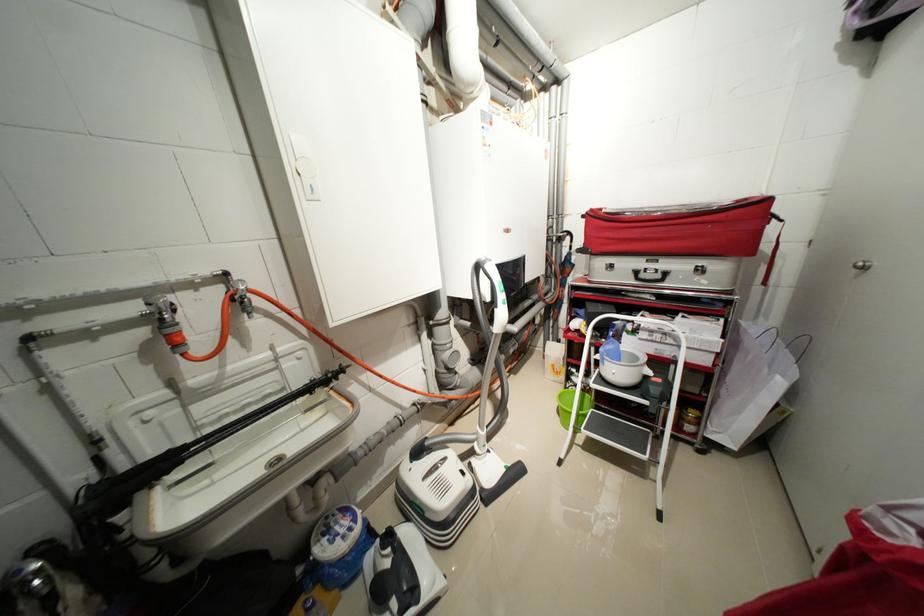
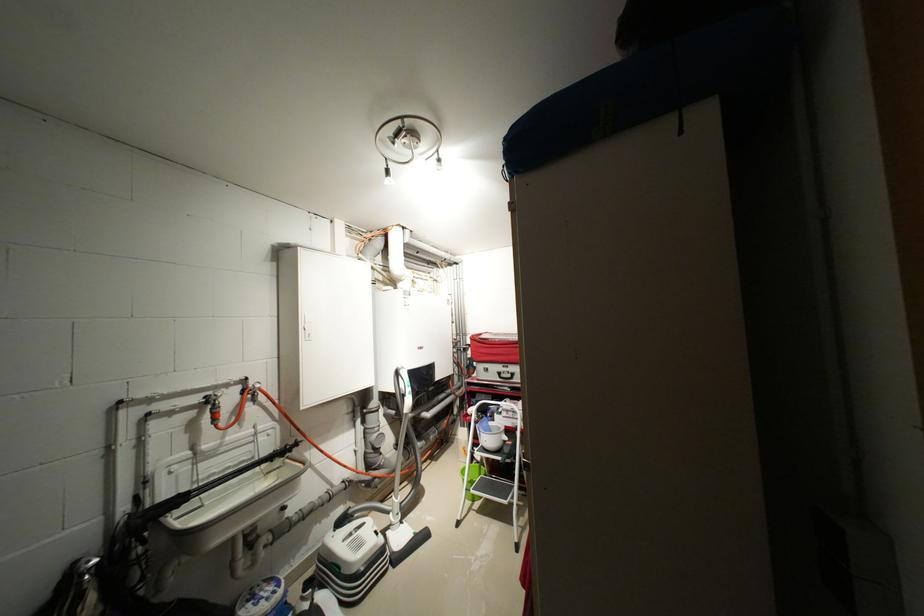
Question: I am providing you with two images of the same scene from different viewpoints. Please identify which objects are invisible in image2.

Choices:
 (A) upright vacuum handle
 (B) red spigot handle
 (C) step stool handle
 (D) none of these

Answer: (D)